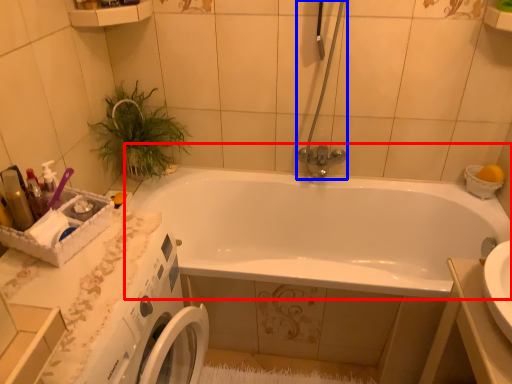
Question: Which object appears closest to the camera in this image, bathtub (highlighted by a red box) or shower door (highlighted by a blue box)?

Choices:
 (A) bathtub
 (B) shower door

Answer: (A)